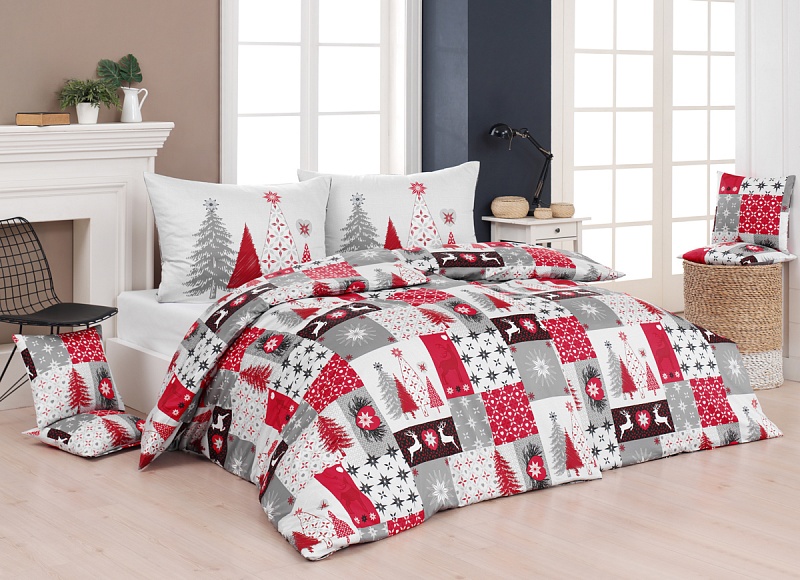
In order to click on book in this screenshot , I will do `click(44, 116)`.